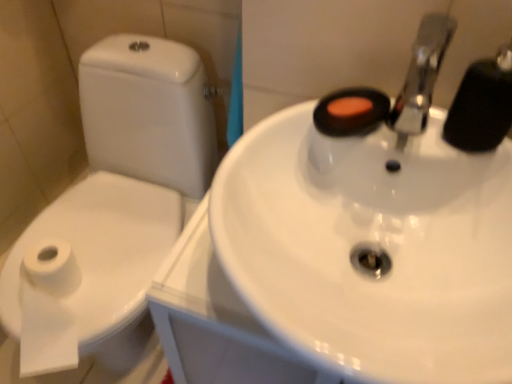
Question: Is the position of black rubber faucet at upper right more distant than that of white glossy sink at center?

Choices:
 (A) no
 (B) yes

Answer: (B)

Question: Could you tell me if black rubber faucet at upper right is turned towards white glossy sink at center?

Choices:
 (A) no
 (B) yes

Answer: (B)

Question: Are black rubber faucet at upper right and white glossy sink at center located far from each other?

Choices:
 (A) no
 (B) yes

Answer: (A)

Question: Is black rubber faucet at upper right positioned before white glossy sink at center?

Choices:
 (A) yes
 (B) no

Answer: (B)

Question: From a real-world perspective, is black rubber faucet at upper right beneath white glossy sink at center?

Choices:
 (A) yes
 (B) no

Answer: (B)

Question: Is white paper bidet at left situated inside white glossy sink at center or outside?

Choices:
 (A) outside
 (B) inside

Answer: (A)

Question: Considering their positions, is white paper bidet at left located in front of or behind white glossy sink at center?

Choices:
 (A) front
 (B) behind

Answer: (B)

Question: Is white paper bidet at left wider or thinner than white glossy sink at center?

Choices:
 (A) thin
 (B) wide

Answer: (A)

Question: Considering the positions of white paper bidet at left and white glossy sink at center in the image, is white paper bidet at left taller or shorter than white glossy sink at center?

Choices:
 (A) short
 (B) tall

Answer: (A)

Question: From a real-world perspective, is black rubber faucet at upper right above or below white glossy sink at center?

Choices:
 (A) above
 (B) below

Answer: (A)

Question: Considering their positions, is black rubber faucet at upper right located in front of or behind white glossy sink at center?

Choices:
 (A) behind
 (B) front

Answer: (A)

Question: In terms of width, does black rubber faucet at upper right look wider or thinner when compared to white glossy sink at center?

Choices:
 (A) thin
 (B) wide

Answer: (A)

Question: Based on their positions, is black rubber faucet at upper right located to the left or right of white glossy sink at center?

Choices:
 (A) right
 (B) left

Answer: (A)

Question: Based on their positions, is white glossy sink at center located to the left or right of white paper bidet at left?

Choices:
 (A) left
 (B) right

Answer: (B)

Question: Is white glossy sink at center spatially inside white paper bidet at left, or outside of it?

Choices:
 (A) inside
 (B) outside

Answer: (B)